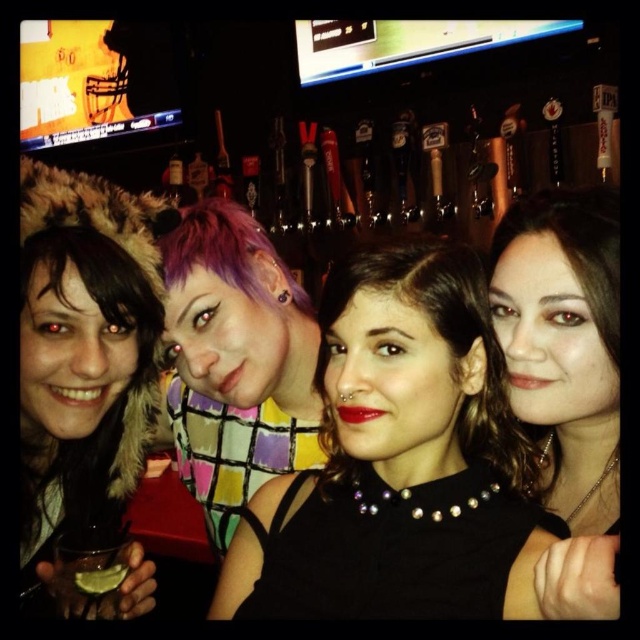
Does brown shiny hair at center have a larger size compared to translucent plastic cup at lower left?

Yes.

Which of these two, brown shiny hair at center or translucent plastic cup at lower left, stands shorter?

Standing shorter between the two is translucent plastic cup at lower left.

Does point (465, 440) come behind point (96, 586)?

Yes, it is behind point (96, 586).

You are a GUI agent. You are given a task and a screenshot of the screen. Output one action in this format:
    pyautogui.click(x=<x>, y=<y>)
    Task: Click on the brown shiny hair at center
    
    Given the screenshot: What is the action you would take?
    [440, 333]

Which is in front, point (234, 380) or point (100, 532)?

Positioned in front is point (100, 532).

Can you confirm if multicolored fabric at center is smaller than clear glass at lower left?

Actually, multicolored fabric at center might be larger than clear glass at lower left.

Who is more distant from viewer, (253, 280) or (99, 577)?

The point (253, 280) is more distant.

Identify the location of multicolored fabric at center. The image size is (640, 640). (236, 362).

Who is more distant from viewer, (84, 476) or (92, 561)?

Positioned behind is point (84, 476).

Image resolution: width=640 pixels, height=640 pixels. In order to click on dark brown fur at left in this screenshot , I will do `click(83, 376)`.